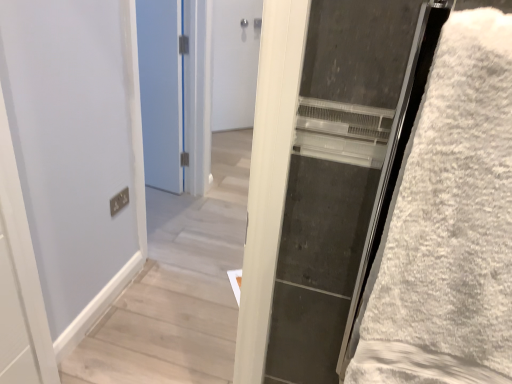
What do you see at coordinates (161, 92) in the screenshot? I see `blue painted door at upper left, marked as the first door in a left-to-right arrangement` at bounding box center [161, 92].

Find the location of a particular element. white matte door at center, which ranks as the first door in right-to-left order is located at coordinates (234, 62).

What are the coordinates of `blue painted door at upper left, placed as the 2th door when sorted from back to front` in the screenshot? It's located at (161, 92).

Does blue painted door at upper left, the first door positioned from the front, appear on the left side of white matte door at center, which ranks as the first door in right-to-left order?

Correct, you'll find blue painted door at upper left, the first door positioned from the front, to the left of white matte door at center, which ranks as the first door in right-to-left order.

I want to click on door lying in front of the white matte door at center, the first door when ordered from back to front, so click(x=161, y=92).

In the scene shown: Is blue painted door at upper left, marked as the first door in a left-to-right arrangement, positioned with its back to white matte door at center, the first door when ordered from back to front?

Yes, blue painted door at upper left, marked as the first door in a left-to-right arrangement,'s orientation is away from white matte door at center, the first door when ordered from back to front.

From a real-world perspective, is white matte door at center, acting as the 2th door starting from the front, over white fluffy bath towel at right?

No, from a real-world perspective, white matte door at center, acting as the 2th door starting from the front, is not over white fluffy bath towel at right

Would you say white fluffy bath towel at right is part of white matte door at center, acting as the 2th door starting from the front,'s contents?

No, white fluffy bath towel at right is not inside white matte door at center, acting as the 2th door starting from the front.

From the image's perspective, is white matte door at center, acting as the 2th door starting from the front, located above white fluffy bath towel at right?

Correct, white matte door at center, acting as the 2th door starting from the front, appears higher than white fluffy bath towel at right in the image.

Which is behind, point (220, 109) or point (380, 293)?

The point (220, 109) is farther.

Based on the photo, from the image's perspective, would you say white fluffy bath towel at right is shown under blue painted door at upper left, placed as the 2th door when sorted from back to front?

Yes, from the image's perspective, white fluffy bath towel at right is beneath blue painted door at upper left, placed as the 2th door when sorted from back to front.

At what (x,y) coordinates should I click in order to perform the action: click on the 1st door positioned above the white fluffy bath towel at right (from the image's perspective). Please return your answer as a coordinate pair (x, y). This screenshot has height=384, width=512. Looking at the image, I should click on (161, 92).

Is white fluffy bath towel at right oriented away from blue painted door at upper left, the second door from the right?

No, white fluffy bath towel at right is not facing away from blue painted door at upper left, the second door from the right.

This screenshot has width=512, height=384. Identify the location of door located above the white matte door at center, which ranks as the first door in right-to-left order (from a real-world perspective). (161, 92).

Can you confirm if white matte door at center, the first door when ordered from back to front, is positioned to the left of blue painted door at upper left, the second door from the right?

In fact, white matte door at center, the first door when ordered from back to front, is to the right of blue painted door at upper left, the second door from the right.

From their relative heights in the image, would you say white matte door at center, the first door when ordered from back to front, is taller or shorter than blue painted door at upper left, the second door from the right?

Considering their sizes, white matte door at center, the first door when ordered from back to front, has less height than blue painted door at upper left, the second door from the right.

Is white matte door at center, acting as the 2th door starting from the front, not inside blue painted door at upper left, marked as the first door in a left-to-right arrangement?

Yes.

Is white fluffy bath towel at right inside the boundaries of white matte door at center, the first door when ordered from back to front, or outside?

white fluffy bath towel at right cannot be found inside white matte door at center, the first door when ordered from back to front.

Can you see white fluffy bath towel at right touching white matte door at center, acting as the 2th door starting from the front?

No, white fluffy bath towel at right is not in contact with white matte door at center, acting as the 2th door starting from the front.

From a real-world perspective, which is physically above, white fluffy bath towel at right or white matte door at center, the first door when ordered from back to front?

In real-world perspective, white fluffy bath towel at right is above.

Which is in front, point (165, 132) or point (490, 316)?

The point (490, 316) is closer.

Considering the sizes of objects blue painted door at upper left, the first door positioned from the front, and white fluffy bath towel at right in the image provided, who is shorter, blue painted door at upper left, the first door positioned from the front, or white fluffy bath towel at right?

With less height is white fluffy bath towel at right.

From the image's perspective, between blue painted door at upper left, placed as the 2th door when sorted from back to front, and white fluffy bath towel at right, who is located below?

white fluffy bath towel at right.

Which object is positioned more to the right, blue painted door at upper left, placed as the 2th door when sorted from back to front, or white fluffy bath towel at right?

From the viewer's perspective, white fluffy bath towel at right appears more on the right side.

I want to click on door beneath the blue painted door at upper left, the first door positioned from the front (from a real-world perspective), so click(x=234, y=62).

Find the location of a particular element. The width and height of the screenshot is (512, 384). the 1st door to the left of the white fluffy bath towel at right, starting your count from the anchor is located at coordinates (234, 62).

Based on their spatial positions, is white fluffy bath towel at right or white matte door at center, the first door when ordered from back to front, further from blue painted door at upper left, placed as the 2th door when sorted from back to front?

white fluffy bath towel at right is further to blue painted door at upper left, placed as the 2th door when sorted from back to front.

Which object lies further to the anchor point white matte door at center, acting as the 2th door starting from the front, blue painted door at upper left, marked as the first door in a left-to-right arrangement, or white fluffy bath towel at right?

Among the two, white fluffy bath towel at right is located further to white matte door at center, acting as the 2th door starting from the front.

When comparing their distances from white fluffy bath towel at right, does blue painted door at upper left, the first door positioned from the front, or white matte door at center, the first door when ordered from back to front, seem closer?

blue painted door at upper left, the first door positioned from the front.

Considering their positions, is white fluffy bath towel at right positioned closer to white matte door at center, the first door when ordered from back to front, than blue painted door at upper left, placed as the 2th door when sorted from back to front?

blue painted door at upper left, placed as the 2th door when sorted from back to front, lies closer to white matte door at center, the first door when ordered from back to front, than the other object.

Which object lies nearer to the anchor point white fluffy bath towel at right, white matte door at center, which appears as the second door when viewed from the left, or blue painted door at upper left, placed as the 2th door when sorted from back to front?

The object closer to white fluffy bath towel at right is blue painted door at upper left, placed as the 2th door when sorted from back to front.

From the image, which object appears to be farther from blue painted door at upper left, marked as the first door in a left-to-right arrangement, white matte door at center, which ranks as the first door in right-to-left order, or white fluffy bath towel at right?

white fluffy bath towel at right is positioned further to the anchor blue painted door at upper left, marked as the first door in a left-to-right arrangement.

This screenshot has width=512, height=384. Find the location of `door between white fluffy bath towel at right and white matte door at center, which ranks as the first door in right-to-left order, from front to back`. door between white fluffy bath towel at right and white matte door at center, which ranks as the first door in right-to-left order, from front to back is located at coordinates (161, 92).